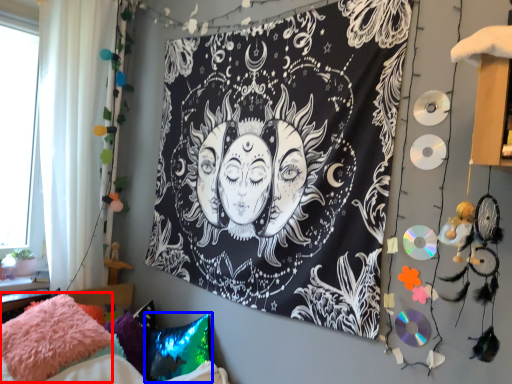
Question: Which point is closer to the camera, pillow (highlighted by a red box) or pillow (highlighted by a blue box)?

Choices:
 (A) pillow
 (B) pillow

Answer: (A)